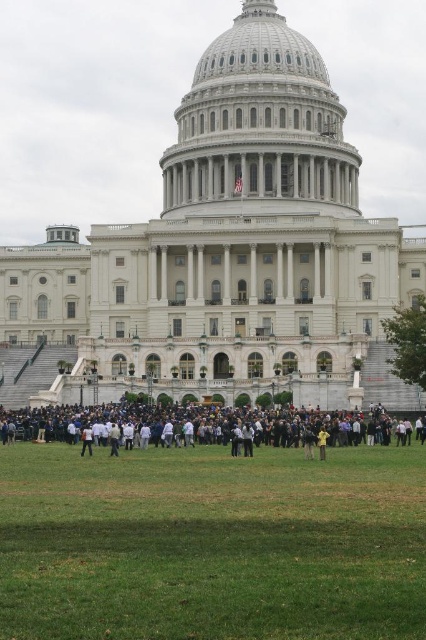
You are a photographer planning to take a photo of the white marble dome at center from the green grass at lower center. Considering their sizes, will the dome appear larger in the photo compared to the grass?

The white marble dome at center is taller than the green grass at lower center, so in the photo taken from the green grass at lower center, the dome will appear larger than the grass.

Based on the photo, you are planning to host a small event and need to set up a 3m wide tent. Based on the image, can the green grass at lower center accommodate the tent without overlapping the dark gray clothing at center?

The green grass at lower center has a width less than the dark gray clothing at center, so the tent may not fit without overlapping since the grass area is narrower than the clothing area.

You are a photographer planning to take a photo of the iconic building from the green grass at lower center. Based on the coordinates provided, where exactly should you position yourself to ensure the building is centered in your shot?

You should position yourself at the coordinates point [212,545] on the green grass at lower center to ensure the building is centered in your shot.